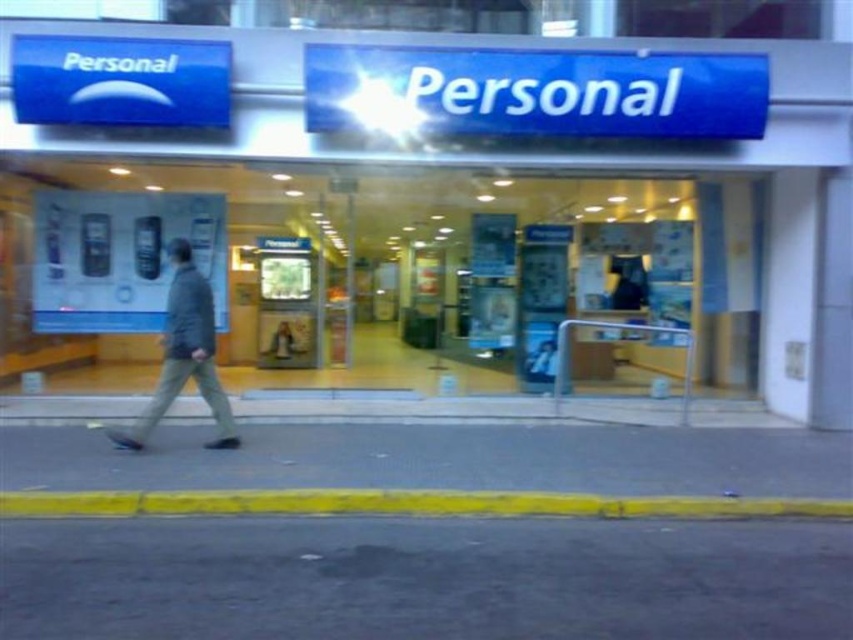
Consider the image. You are standing directly in front of the store entrance. Where is the blue plastic sign at upper center located relative to your position?

The blue plastic sign at upper center is located at the upper center position above the store entrance, which is directly above your current position in front of the entrance.

You are standing outside the store and want to touch both points on the store facade. Which point should you reach for first, the point at coordinates point (440, 620) or point (838, 445)?

You should reach for the point at coordinates point (440, 620) first because it is closer to you than point (838, 445).

You are standing in front of the store and want to compare the size of the blue plastic sign at upper center and the dark gray asphalt at lower center. Which one is wider?

The blue plastic sign at upper center is wider than the dark gray asphalt at lower center.